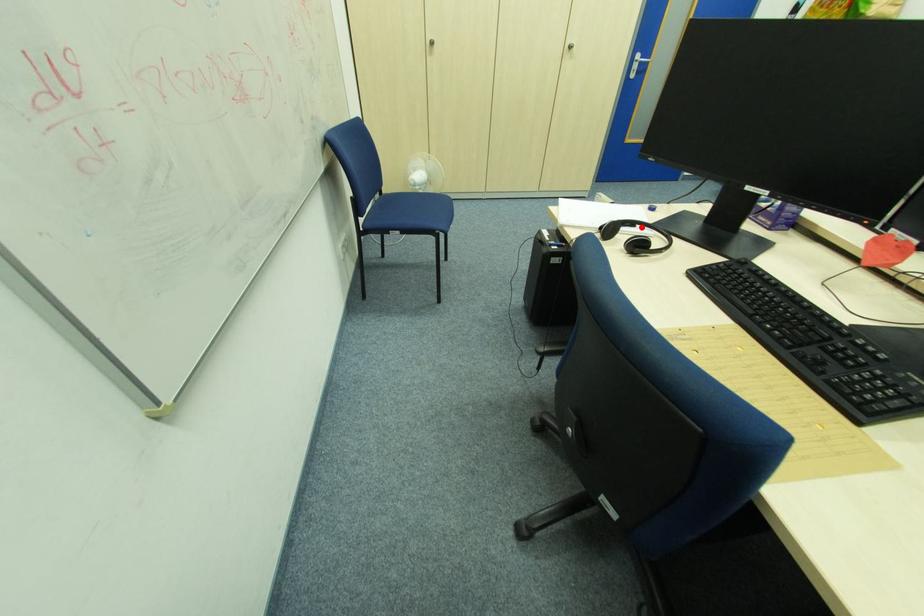
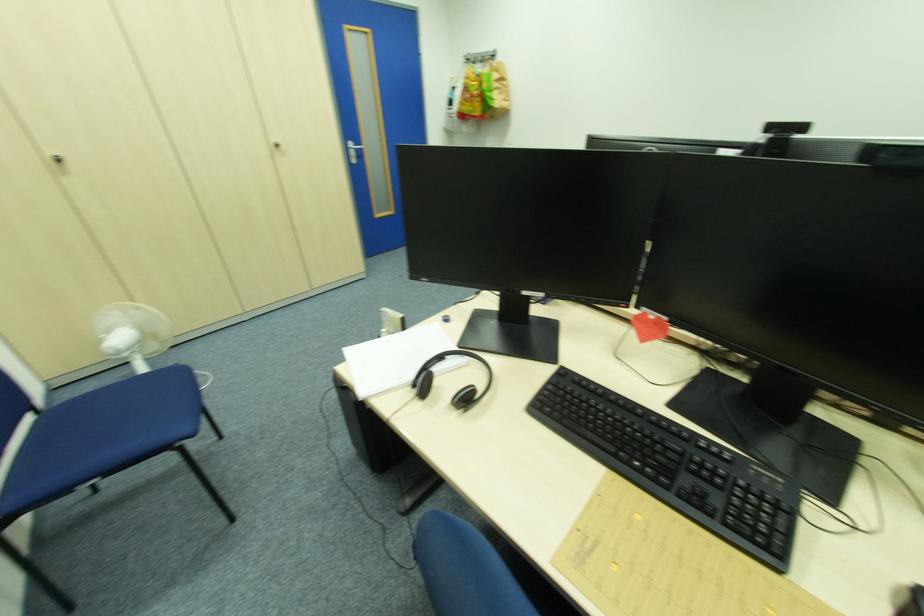
In the second image, find the point that corresponds to the highlighted location in the first image.

(454, 359)